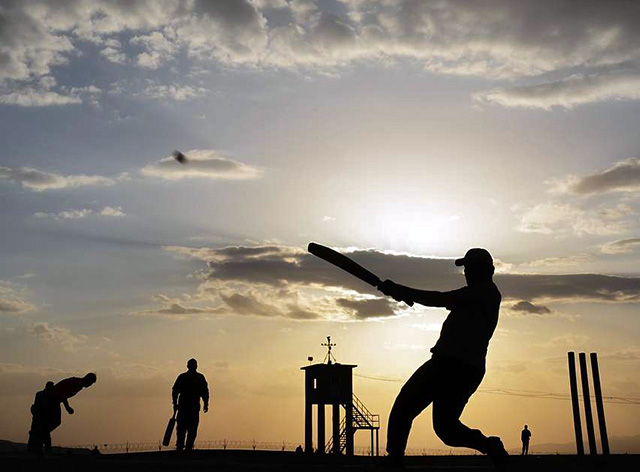
Find the location of a particular element. The width and height of the screenshot is (640, 472). staircase is located at coordinates (361, 419), (348, 439).